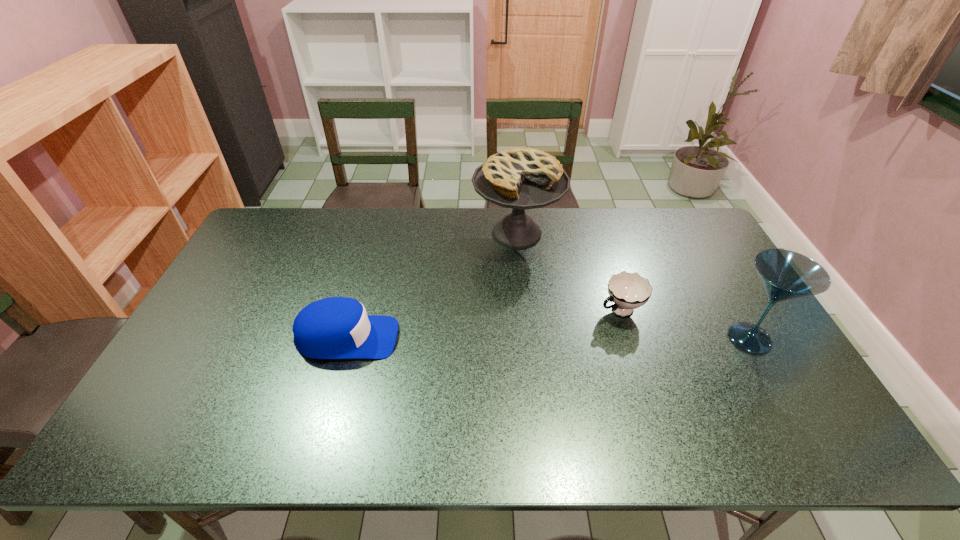
You are a GUI agent. You are given a task and a screenshot of the screen. Output one action in this format:
    pyautogui.click(x=<x>, y=<y>)
    Task: Click on the leftmost object
    The height and width of the screenshot is (540, 960).
    Given the screenshot: What is the action you would take?
    pyautogui.click(x=336, y=327)

Where is `martini`? The height and width of the screenshot is (540, 960). martini is located at coordinates (786, 275).

Where is `cup`? cup is located at coordinates pyautogui.click(x=628, y=291).

This screenshot has width=960, height=540. Find the location of `the farthest object`. the farthest object is located at coordinates (523, 178).

Where is `pie`? This screenshot has width=960, height=540. pie is located at coordinates (523, 178).

Image resolution: width=960 pixels, height=540 pixels. I want to click on vacant space situated 0.220m on the front-facing side of the baseball cap, so click(477, 338).

You are a GUI agent. You are given a task and a screenshot of the screen. Output one action in this format:
    pyautogui.click(x=<x>, y=<y>)
    Task: Click on the vacant space located 0.310m on the left of the rightmost object
    The image size is (960, 540).
    Given the screenshot: What is the action you would take?
    pyautogui.click(x=608, y=339)

Identify the location of free space located 0.280m on the side of the third object from left to right with the handle. (522, 359).

Find the location of a particular element. The height and width of the screenshot is (540, 960). vacant space situated 0.160m on the side of the third object from left to right with the handle is located at coordinates (558, 340).

You are a GUI agent. You are given a task and a screenshot of the screen. Output one action in this format:
    pyautogui.click(x=<x>, y=<y>)
    Task: Click on the vacant region located 0.190m on the side of the third object from left to right with the handle
    The height and width of the screenshot is (540, 960).
    Given the screenshot: What is the action you would take?
    pyautogui.click(x=549, y=345)